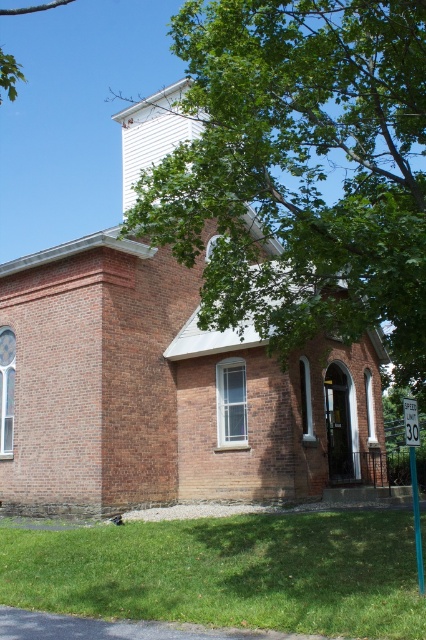
Question: Can you confirm if brick building at center is positioned to the right of green leafy tree at upper center?

Choices:
 (A) no
 (B) yes

Answer: (A)

Question: Does brick building at center appear over green leafy tree at upper center?

Choices:
 (A) no
 (B) yes

Answer: (A)

Question: Can you confirm if brick building at center is smaller than green leafy tree at upper center?

Choices:
 (A) yes
 (B) no

Answer: (A)

Question: Among these objects, which one is farthest from the camera?

Choices:
 (A) brick building at center
 (B) green leafy tree at upper center

Answer: (A)

Question: Among these objects, which one is farthest from the camera?

Choices:
 (A) green leafy tree at upper center
 (B) brick building at center

Answer: (B)